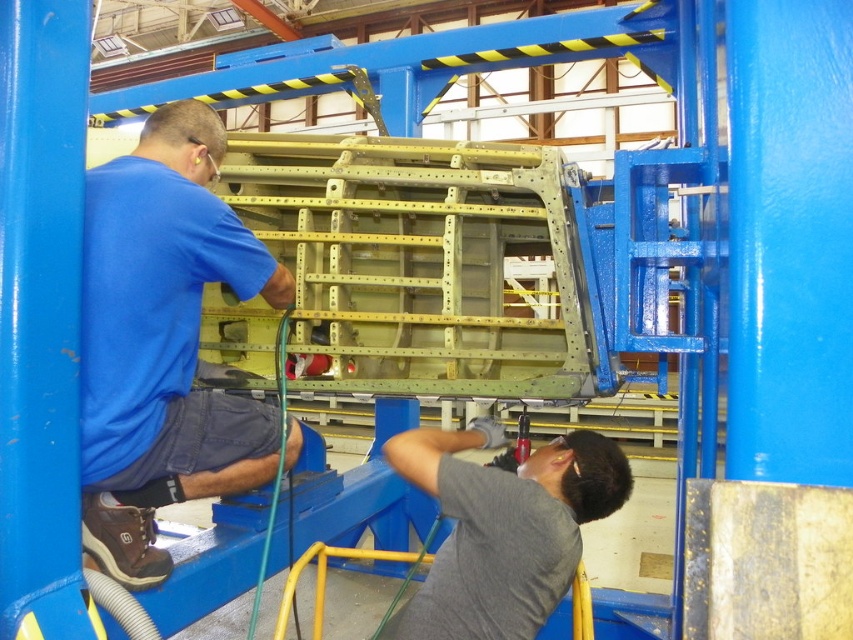
Does blue fabric shirt at upper left come behind gray matte shirt at lower center?

No.

Does blue fabric shirt at upper left have a lesser height compared to gray matte shirt at lower center?

In fact, blue fabric shirt at upper left may be taller than gray matte shirt at lower center.

Which is in front, point (152, 323) or point (476, 604)?

Point (152, 323) is more forward.

Find the location of `blue fabric shirt at upper left`. blue fabric shirt at upper left is located at coordinates (163, 340).